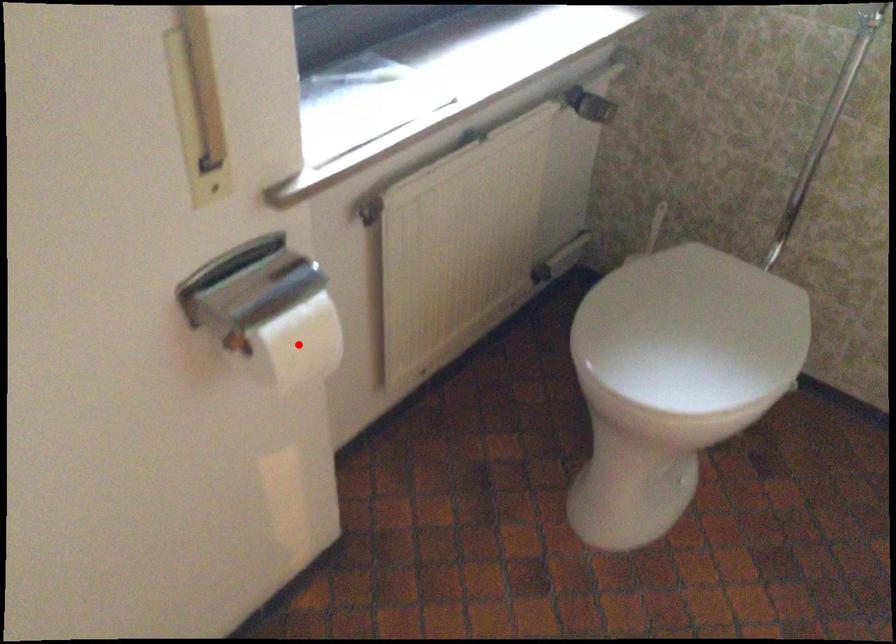
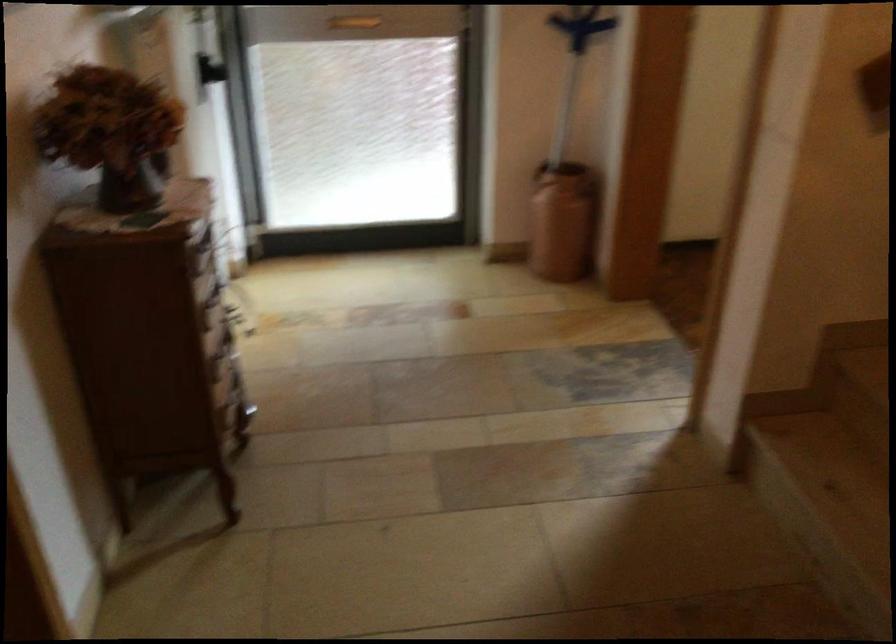
Question: I am providing you with two images of the same scene from different viewpoints. A red point is marked on the first image. Is the red point's position out of view in image 2?

Choices:
 (A) Yes
 (B) No

Answer: (A)